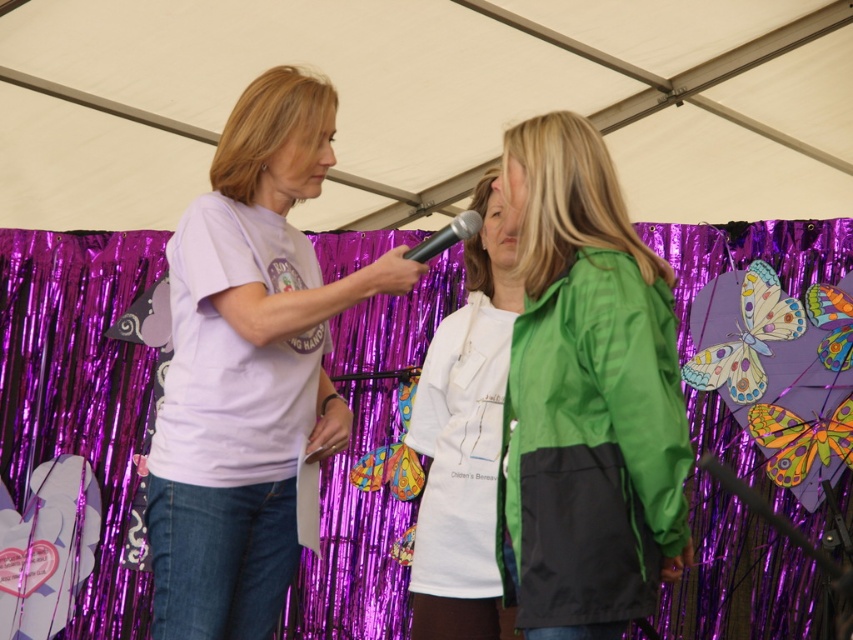
You are a photographer at the event and need to adjust the lighting to focus on the green matte jacket at center. Where exactly should you direct the light based on its coordinates?

The green matte jacket at center is located at coordinates point (585, 396), so direct the light there.

You are standing in the center of the scene and want to move towards the point labeled as point [585,396]. Is this point located near the green matte jacket at center?

Yes, the point [585,396] corresponds to the green matte jacket at center, so it is located near the green matte jacket at center.